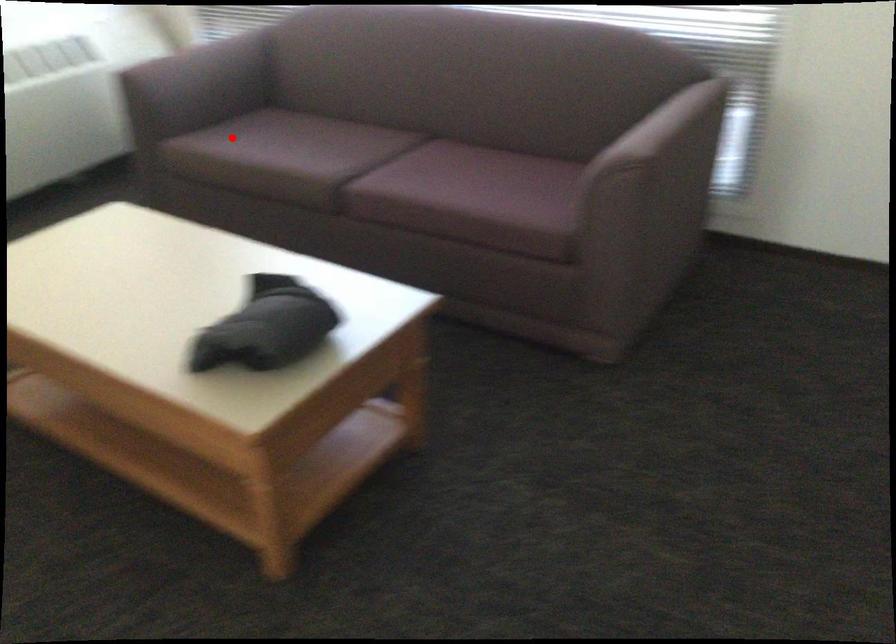
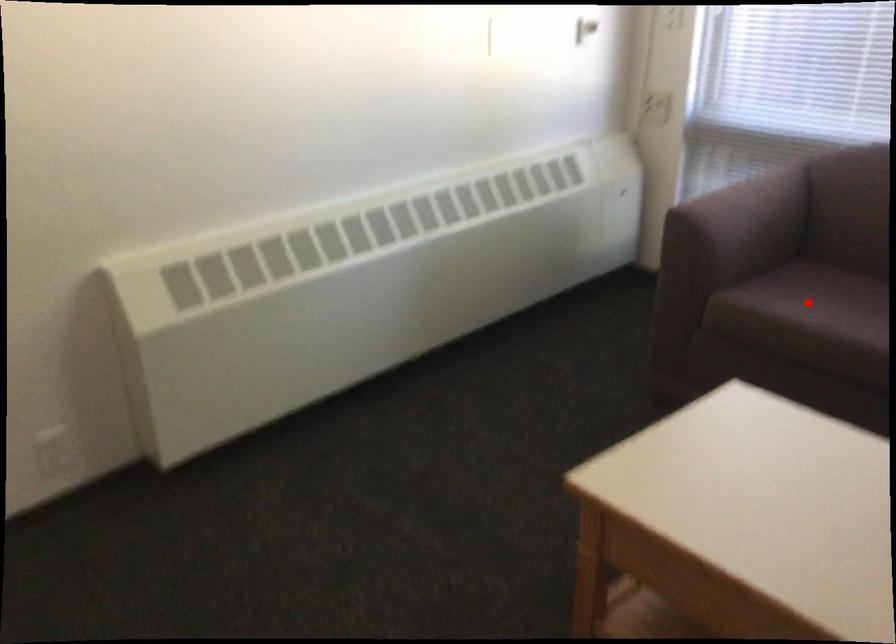
I am providing you with two images of the same scene from different viewpoints. A red point is marked on the first image and another point is marked on the second image. Is the marked point in image1 the same physical position as the marked point in image2?

Yes